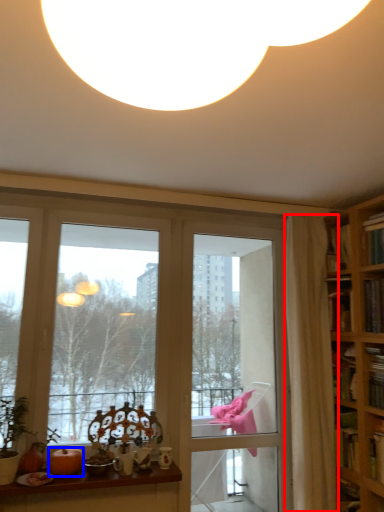
Question: Which object appears closest to the camera in this image, curtain (highlighted by a red box) or pumpkin (highlighted by a blue box)?

Choices:
 (A) curtain
 (B) pumpkin

Answer: (B)